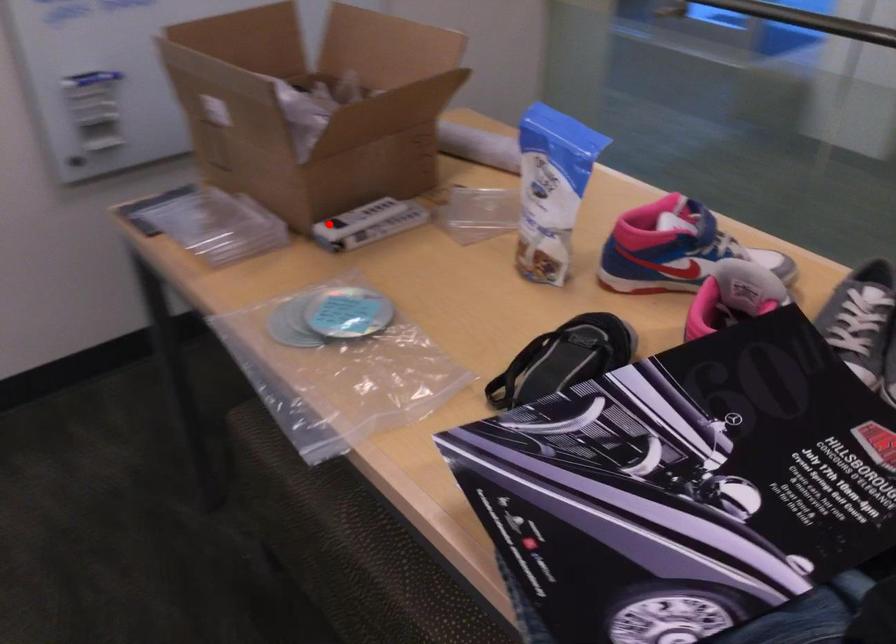
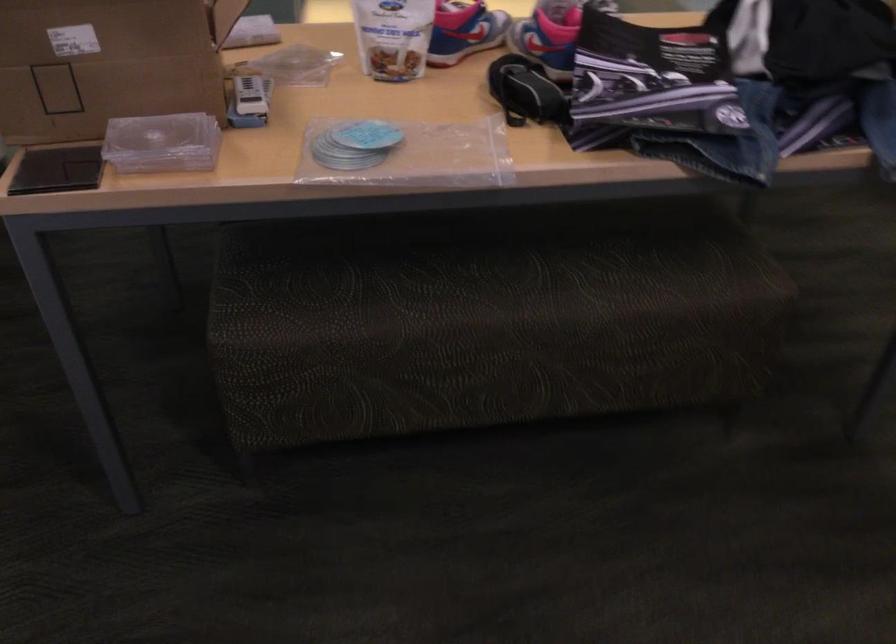
Locate, in the second image, the point that corresponds to the highlighted location in the first image.

(247, 99)